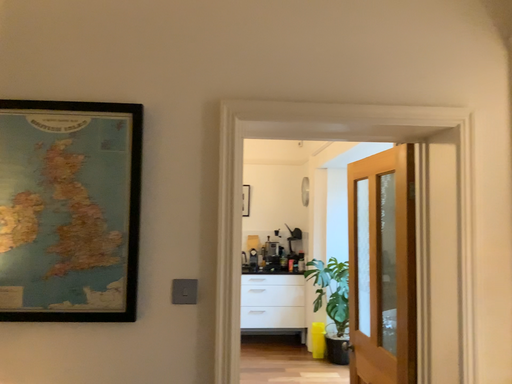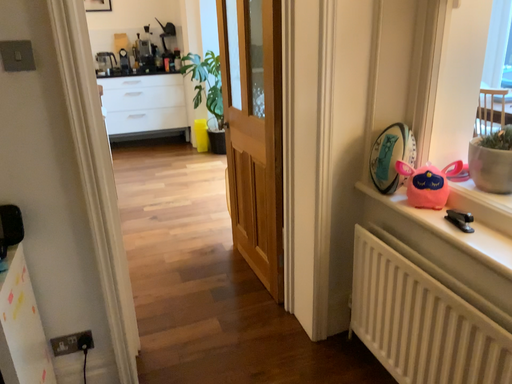
Question: How did the camera likely rotate when shooting the video?

Choices:
 (A) rotated upward
 (B) rotated downward

Answer: (B)